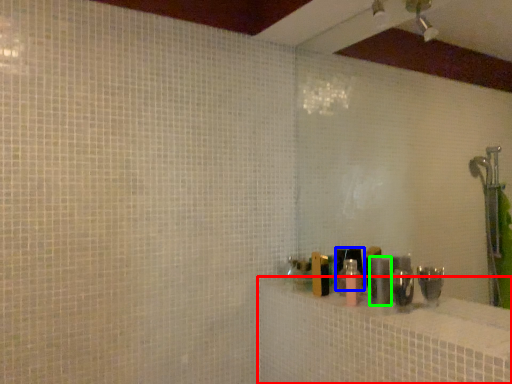
Question: Considering the real-world distances, which object is farthest from bath (highlighted by a red box)? toiletry (highlighted by a blue box) or toiletry (highlighted by a green box)?

Choices:
 (A) toiletry
 (B) toiletry

Answer: (A)